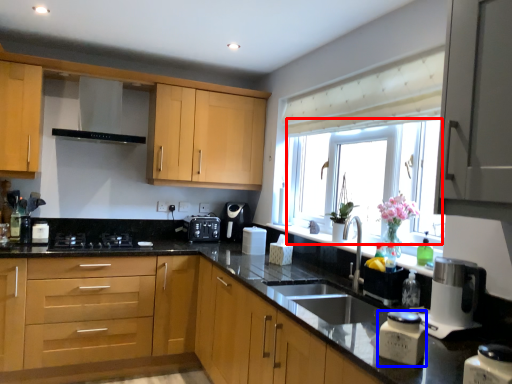
Question: Which point is closer to the camera, window screen (highlighted by a red box) or kitchen appliance (highlighted by a blue box)?

Choices:
 (A) window screen
 (B) kitchen appliance

Answer: (B)